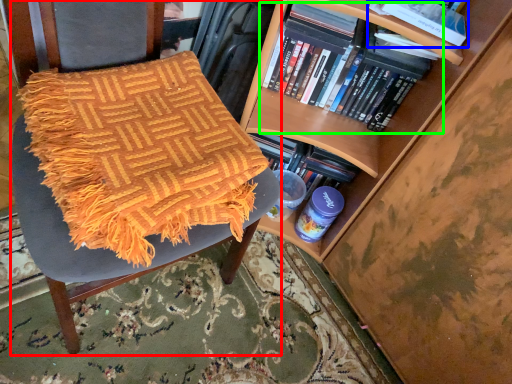
Question: Based on their relative distances, which object is farther from chair (highlighted by a red box)? Choose from book (highlighted by a blue box) and book (highlighted by a green box).

Choices:
 (A) book
 (B) book

Answer: (A)